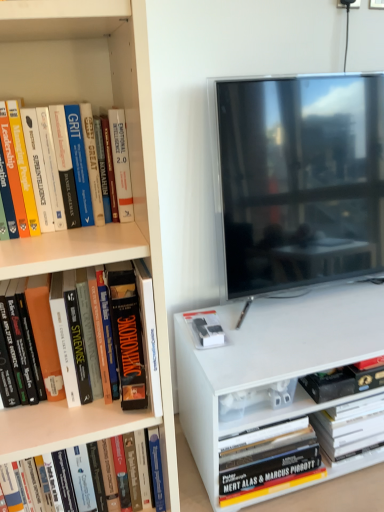
Question: Considering the relative sizes of hardcover book at lower left, marked as the 2th book in a left-to-right arrangement, and flat-screen tv at right in the image provided, is hardcover book at lower left, marked as the 2th book in a left-to-right arrangement, bigger than flat-screen tv at right?

Choices:
 (A) no
 (B) yes

Answer: (A)

Question: Is hardcover book at lower left, which appears as the 2th book when viewed from the front, oriented away from flat-screen tv at right?

Choices:
 (A) yes
 (B) no

Answer: (B)

Question: Considering the relative positions of hardcover book at lower left, which appears as the 2th book when viewed from the front, and flat-screen tv at right in the image provided, is hardcover book at lower left, which appears as the 2th book when viewed from the front, to the right of flat-screen tv at right from the viewer's perspective?

Choices:
 (A) yes
 (B) no

Answer: (B)

Question: Are hardcover book at lower left, which appears as the 2th book when viewed from the front, and flat-screen tv at right located far from each other?

Choices:
 (A) yes
 (B) no

Answer: (B)

Question: From the image's perspective, is hardcover book at lower left, positioned as the third book in back-to-front order, beneath flat-screen tv at right?

Choices:
 (A) no
 (B) yes

Answer: (B)

Question: Is hardcover book at lower left, positioned as the third book in back-to-front order, closer to the viewer compared to flat-screen tv at right?

Choices:
 (A) yes
 (B) no

Answer: (A)

Question: Is orange matte book at left, arranged as the fourth book when viewed from the back, shorter than flat-screen tv at right?

Choices:
 (A) no
 (B) yes

Answer: (B)

Question: From a real-world perspective, is orange matte book at left, placed as the fourth book when sorted from right to left, on top of flat-screen tv at right?

Choices:
 (A) no
 (B) yes

Answer: (A)

Question: Is orange matte book at left, placed as the fourth book when sorted from right to left, not within flat-screen tv at right?

Choices:
 (A) yes
 (B) no

Answer: (A)

Question: Is orange matte book at left, which ranks as the 1th book in front-to-back order, bigger than flat-screen tv at right?

Choices:
 (A) no
 (B) yes

Answer: (A)

Question: From a real-world perspective, is orange matte book at left, which is the 1th book in left-to-right order, physically below flat-screen tv at right?

Choices:
 (A) no
 (B) yes

Answer: (B)

Question: Is orange matte book at left, placed as the fourth book when sorted from right to left, closer to the viewer compared to flat-screen tv at right?

Choices:
 (A) yes
 (B) no

Answer: (A)

Question: Does hardcover book at lower left, marked as the 2th book in a left-to-right arrangement, have a smaller size compared to orange matte book at left, placed as the fourth book when sorted from right to left?

Choices:
 (A) no
 (B) yes

Answer: (B)